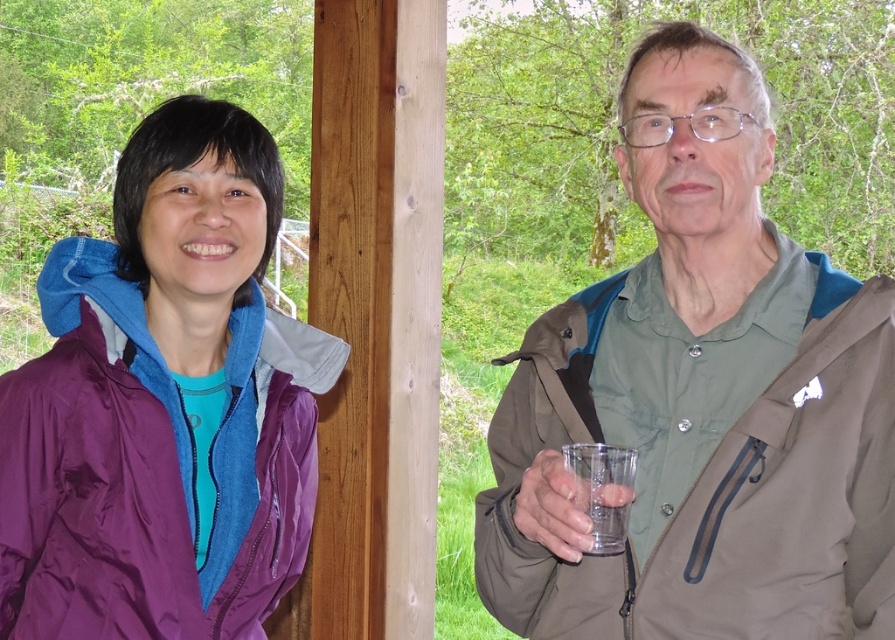
You are a photographer trying to capture a photo of the purple nylon jacket at left and the transparent plastic cup at right. To ensure both are in frame, you need to know their positions relative to each other. Which object is positioned to the left of the other?

The purple nylon jacket at left is to the left of the transparent plastic cup at right.

You are a photographer trying to capture both the matte green shirt at center and the purple nylon jacket at left in a single frame. Given their sizes, which object should you focus on to ensure both fit clearly in the photo?

The matte green shirt at center is larger in size than the purple nylon jacket at left, so you should focus on the matte green shirt at center to ensure both objects fit clearly in the photo.

You are a photographer trying to capture a group photo of the purple nylon jacket at left and the man in greenish gray jacket. Where should you position yourself to ensure both subjects are in frame?

The purple nylon jacket at left is located at point (x=150, y=468). To include both subjects in the frame, position yourself centrally between their positions, ensuring the camera captures the coordinates of both subjects.